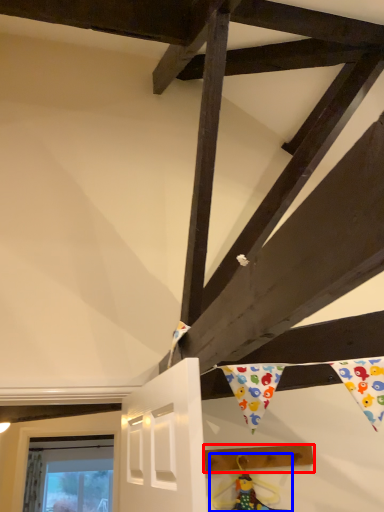
Question: Which object is further to the camera taking this photo, plank (highlighted by a red box) or doll (highlighted by a blue box)?

Choices:
 (A) plank
 (B) doll

Answer: (A)